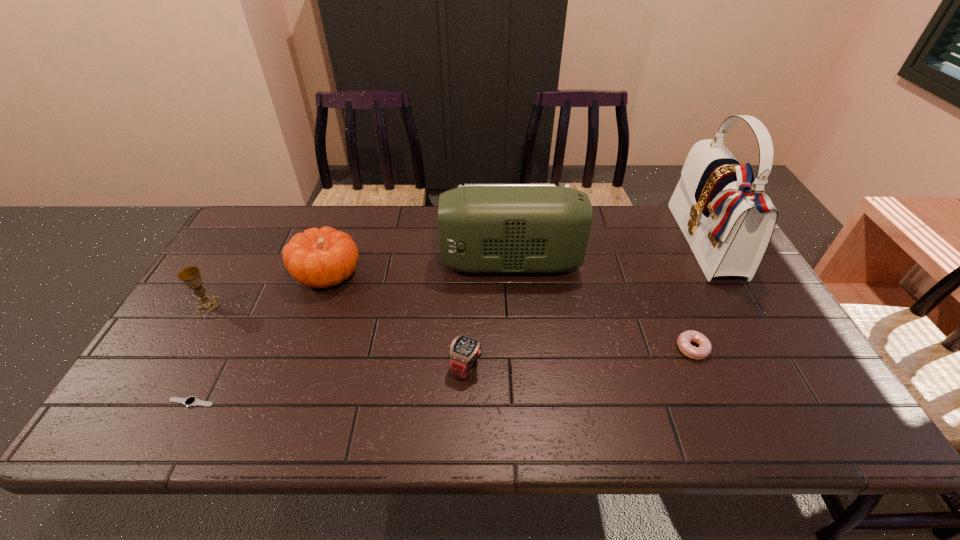
Image resolution: width=960 pixels, height=540 pixels. Identify the location of the tallest object. (728, 221).

This screenshot has width=960, height=540. I want to click on the rightmost object, so click(x=728, y=221).

Find the location of a particular element. the second tallest object is located at coordinates (483, 228).

This screenshot has width=960, height=540. Identify the location of pumpkin. (324, 257).

The image size is (960, 540). I want to click on the leftmost object, so click(190, 276).

Where is `the right watch`? The image size is (960, 540). the right watch is located at coordinates (464, 351).

Find the location of a particular element. The image size is (960, 540). the farther watch is located at coordinates (464, 351).

This screenshot has height=540, width=960. What are the coordinates of `the second shortest object` in the screenshot? It's located at (684, 339).

The width and height of the screenshot is (960, 540). Find the location of `the sixth object from left to right`. the sixth object from left to right is located at coordinates (684, 339).

The width and height of the screenshot is (960, 540). I want to click on the shorter watch, so (192, 400).